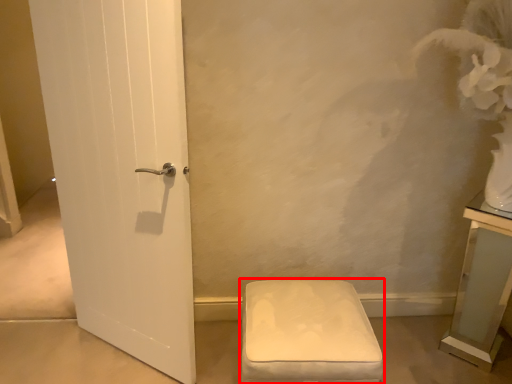
Question: In this image, where is furniture (annotated by the red box) located relative to vanity?

Choices:
 (A) right
 (B) left

Answer: (B)